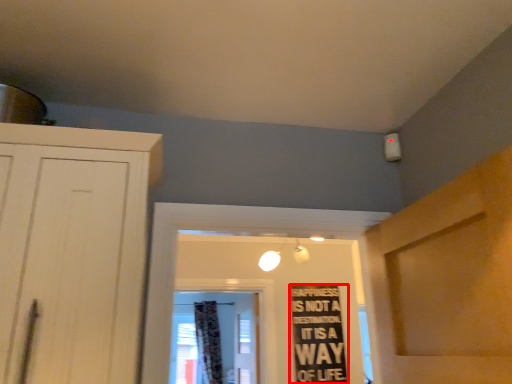
Question: Observing the image, what is the correct spatial positioning of bulletin board (annotated by the red box) in reference to curtain?

Choices:
 (A) left
 (B) right

Answer: (B)